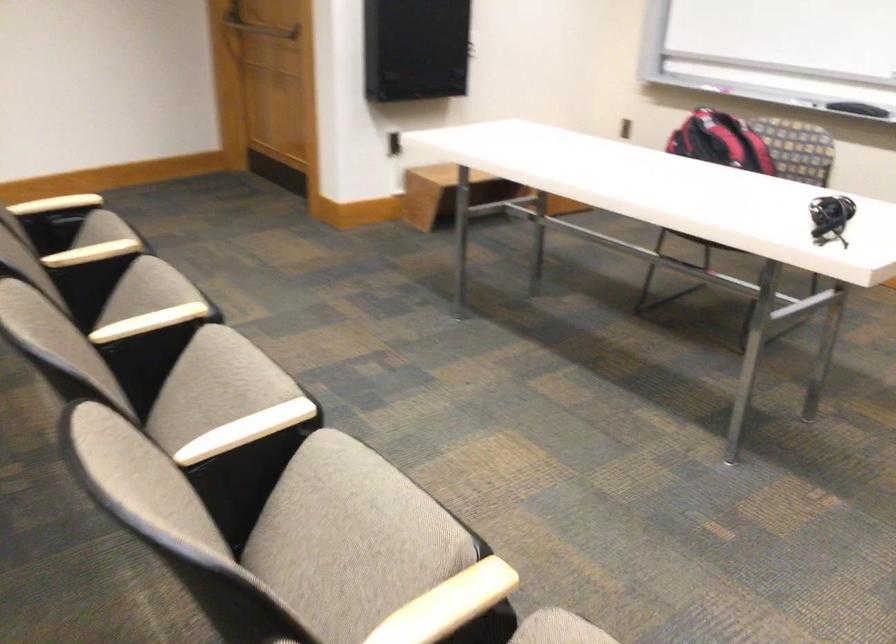
Describe the element at coordinates (720, 142) in the screenshot. I see `the red and black backpack` at that location.